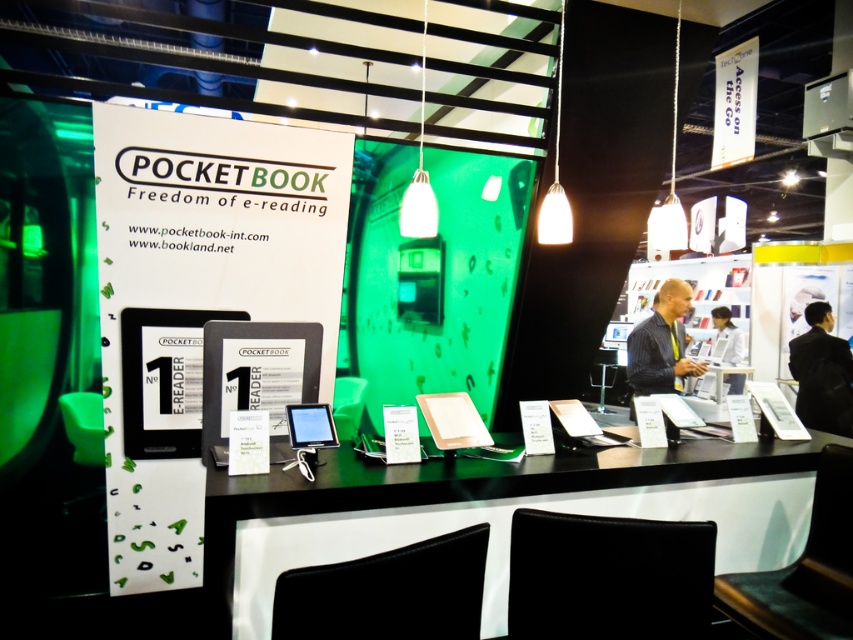
Question: Considering the real-world distances, which object is farthest from the striped shirt at center?

Choices:
 (A) white glossy laptop at center
 (B) black leather jacket at right

Answer: (A)

Question: Which object appears closest to the camera in this image?

Choices:
 (A) black leather jacket at right
 (B) striped shirt at center

Answer: (B)

Question: Can you confirm if black leather jacket at right is wider than striped shirt at center?

Choices:
 (A) no
 (B) yes

Answer: (A)

Question: Is striped shirt at center bigger than white glossy laptop at center?

Choices:
 (A) yes
 (B) no

Answer: (A)

Question: Which point is farther from the camera taking this photo?

Choices:
 (A) (839, 392)
 (B) (659, 346)

Answer: (A)

Question: Does black leather jacket at right have a lesser width compared to white glossy laptop at center?

Choices:
 (A) yes
 (B) no

Answer: (B)